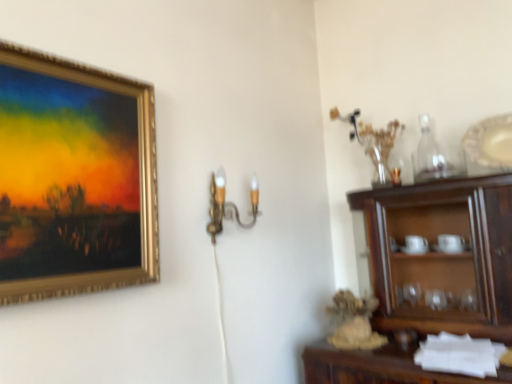
Locate an element on the screen. This screenshot has width=512, height=384. white glossy platter at upper right is located at coordinates (489, 145).

Find the location of a particular element. This screenshot has height=384, width=512. gold metallic wall sconce at center is located at coordinates (228, 204).

This screenshot has width=512, height=384. I want to click on white wood cabinet at lower right, so (379, 367).

Describe the element at coordinates (428, 154) in the screenshot. I see `clear glass bottle at upper right` at that location.

Identify the location of dark wood cabinet at right. The height and width of the screenshot is (384, 512). (442, 254).

Find the location of a particular element. The height and width of the screenshot is (384, 512). white glossy platter at upper right is located at coordinates (489, 145).

From the image's perspective, is clear glass bottle at upper right over gold metallic picture frame at upper left?

Yes, from the image's perspective, clear glass bottle at upper right is above gold metallic picture frame at upper left.

Considering the positions of point (435, 162) and point (44, 210), is point (435, 162) closer or farther from the camera than point (44, 210)?

Point (435, 162).

Can you tell me how much clear glass bottle at upper right and gold metallic picture frame at upper left differ in facing direction?

There is a 90.1-degree angle between the facing directions of clear glass bottle at upper right and gold metallic picture frame at upper left.

Does clear glass bottle at upper right have a lesser height compared to gold metallic picture frame at upper left?

Yes.

Consider the image. In the image, is white wood cabinet at lower right positioned in front of or behind gold metallic picture frame at upper left?

white wood cabinet at lower right is behind gold metallic picture frame at upper left.

From the image's perspective, which is above, white wood cabinet at lower right or gold metallic picture frame at upper left?

gold metallic picture frame at upper left.

Find the location of `picture frame that is above the white wood cabinet at lower right (from the image's perspective)`. picture frame that is above the white wood cabinet at lower right (from the image's perspective) is located at coordinates (75, 176).

Is clear glass bottle at upper right aimed at white wood cabinet at lower right?

No, clear glass bottle at upper right is not oriented towards white wood cabinet at lower right.

Is clear glass bottle at upper right inside the boundaries of white wood cabinet at lower right, or outside?

clear glass bottle at upper right is located beyond the bounds of white wood cabinet at lower right.

Considering the sizes of objects clear glass bottle at upper right and white wood cabinet at lower right in the image provided, who is taller, clear glass bottle at upper right or white wood cabinet at lower right?

clear glass bottle at upper right is taller.

From the image's perspective, is white glossy platter at upper right located beneath gold metallic wall sconce at center?

Incorrect, from the image's perspective, white glossy platter at upper right is higher than gold metallic wall sconce at center.

Does white glossy platter at upper right have a lesser width compared to gold metallic wall sconce at center?

Correct, the width of white glossy platter at upper right is less than that of gold metallic wall sconce at center.

Who is bigger, white glossy platter at upper right or gold metallic wall sconce at center?

gold metallic wall sconce at center.

Locate an element on the screen. The image size is (512, 384). shelf behind the white wood cabinet at lower right is located at coordinates (442, 254).

Would you say white wood cabinet at lower right is a long distance from dark wood cabinet at right?

No, white wood cabinet at lower right is in close proximity to dark wood cabinet at right.

Is white wood cabinet at lower right completely or partially outside of dark wood cabinet at right?

Yes.

Is point (408, 352) closer to viewer compared to point (450, 262)?

Yes, point (408, 352) is closer to viewer.

From a real-world perspective, who is located lower, dark wood cabinet at right or white wood cabinet at lower right?

From a 3D spatial view, white wood cabinet at lower right is below.

Based on the photo, who is bigger, dark wood cabinet at right or white wood cabinet at lower right?

With larger size is dark wood cabinet at right.

Which of these two, dark wood cabinet at right or white wood cabinet at lower right, is thinner?

With smaller width is dark wood cabinet at right.

Find the location of a particular element. shelf lying above the white wood cabinet at lower right (from the image's perspective) is located at coordinates (442, 254).

How many degrees apart are the facing directions of white glossy platter at upper right and dark wood cabinet at right?

3.17 degrees.

Is white glossy platter at upper right far away from dark wood cabinet at right?

No, white glossy platter at upper right is in close proximity to dark wood cabinet at right.

Locate an element on the screen. The width and height of the screenshot is (512, 384). shelf in front of the white glossy platter at upper right is located at coordinates (442, 254).

Is point (497, 141) farther from camera compared to point (508, 323)?

Yes, point (497, 141) is behind point (508, 323).

Identify the location of bottle above the gold metallic picture frame at upper left (from the image's perspective). The image size is (512, 384). (428, 154).

The image size is (512, 384). I want to click on picture frame in front of the white wood cabinet at lower right, so click(x=75, y=176).

Based on their spatial positions, is clear glass bottle at upper right or white glossy platter at upper right further from dark wood cabinet at right?

clear glass bottle at upper right.

Looking at the image, which one is located further to white wood cabinet at lower right, white glossy platter at upper right or clear glass bottle at upper right?

Among the two, clear glass bottle at upper right is located further to white wood cabinet at lower right.

Based on their spatial positions, is dark wood cabinet at right or white glossy platter at upper right further from clear glass bottle at upper right?

dark wood cabinet at right is positioned further to the anchor clear glass bottle at upper right.

Looking at the image, which one is located closer to dark wood cabinet at right, white glossy platter at upper right or white wood cabinet at lower right?

Based on the image, white glossy platter at upper right appears to be nearer to dark wood cabinet at right.

Which object lies further to the anchor point dark wood cabinet at right, gold metallic wall sconce at center or clear glass bottle at upper right?

gold metallic wall sconce at center lies further to dark wood cabinet at right than the other object.

Consider the image. When comparing their distances from white wood cabinet at lower right, does gold metallic wall sconce at center or clear glass bottle at upper right seem closer?

The object closer to white wood cabinet at lower right is gold metallic wall sconce at center.

When comparing their distances from gold metallic wall sconce at center, does dark wood cabinet at right or white wood cabinet at lower right seem closer?

Based on the image, white wood cabinet at lower right appears to be nearer to gold metallic wall sconce at center.

Considering their positions, is white glossy platter at upper right positioned further to clear glass bottle at upper right than gold metallic wall sconce at center?

gold metallic wall sconce at center is positioned further to the anchor clear glass bottle at upper right.

I want to click on shelf between white glossy platter at upper right and white wood cabinet at lower right vertically, so click(x=442, y=254).

I want to click on candle holder between gold metallic picture frame at upper left and white glossy platter at upper right in the horizontal direction, so click(228, 204).

At what (x,y) coordinates should I click in order to perform the action: click on cabinetry located between gold metallic wall sconce at center and white glossy platter at upper right in the left-right direction. Please return your answer as a coordinate pair (x, y). Looking at the image, I should click on (379, 367).

The height and width of the screenshot is (384, 512). I want to click on shelf between clear glass bottle at upper right and white wood cabinet at lower right in the vertical direction, so click(x=442, y=254).